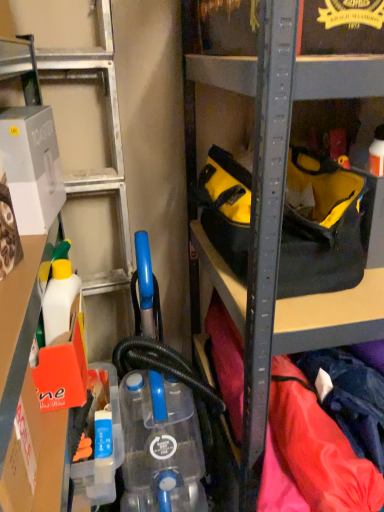
Question: Considering the relative sizes of white plastic container at left and yellow fabric tool bag at center in the image provided, is white plastic container at left taller than yellow fabric tool bag at center?

Choices:
 (A) yes
 (B) no

Answer: (A)

Question: Is yellow fabric tool bag at center at the back of white plastic container at left?

Choices:
 (A) yes
 (B) no

Answer: (B)

Question: Is white plastic container at left oriented towards yellow fabric tool bag at center?

Choices:
 (A) yes
 (B) no

Answer: (A)

Question: Would you say yellow fabric tool bag at center is part of white plastic container at left's contents?

Choices:
 (A) no
 (B) yes

Answer: (A)

Question: Is the depth of white plastic container at left less than that of yellow fabric tool bag at center?

Choices:
 (A) no
 (B) yes

Answer: (B)

Question: Does white plastic container at left have a greater width compared to yellow fabric tool bag at center?

Choices:
 (A) no
 (B) yes

Answer: (A)

Question: Does yellow fabric tool bag at center have a lesser width compared to white cardboard toaster at left?

Choices:
 (A) yes
 (B) no

Answer: (B)

Question: Considering the relative sizes of yellow fabric tool bag at center and white cardboard toaster at left in the image provided, is yellow fabric tool bag at center smaller than white cardboard toaster at left?

Choices:
 (A) no
 (B) yes

Answer: (A)

Question: Does yellow fabric tool bag at center appear on the right side of white cardboard toaster at left?

Choices:
 (A) no
 (B) yes

Answer: (B)

Question: From the image's perspective, does yellow fabric tool bag at center appear higher than white cardboard toaster at left?

Choices:
 (A) yes
 (B) no

Answer: (B)

Question: From a real-world perspective, is yellow fabric tool bag at center located beneath white cardboard toaster at left?

Choices:
 (A) no
 (B) yes

Answer: (B)

Question: From the image's perspective, would you say yellow fabric tool bag at center is shown under white cardboard toaster at left?

Choices:
 (A) no
 (B) yes

Answer: (B)

Question: Does white cardboard toaster at left come behind blue translucent bottle at lower center?

Choices:
 (A) yes
 (B) no

Answer: (B)